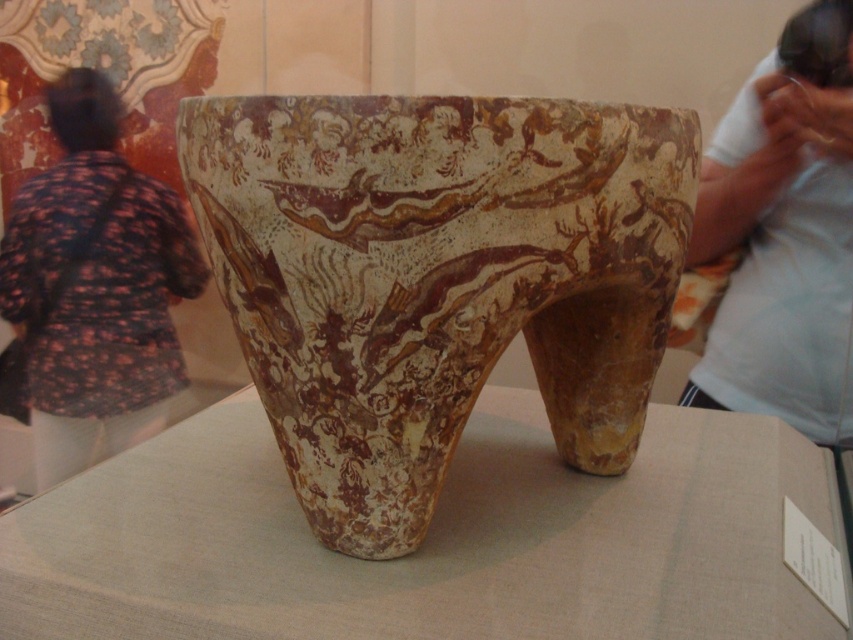
You are a museum curator planning to install a new spotlight on the ceiling directly above the brown textured vase at center. What are the coordinates where you should position the spotlight?

The coordinates for the brown textured vase at center are point (436, 278), so the spotlight should be positioned directly above these coordinates to illuminate it properly.

You are a museum visitor standing in front of a large ancient ceramic vessel displayed on a table. You notice a specific point labeled as point (436, 278). Which object in the scene does this point belong to?

The point (436, 278) is on the brown textured vase at center.